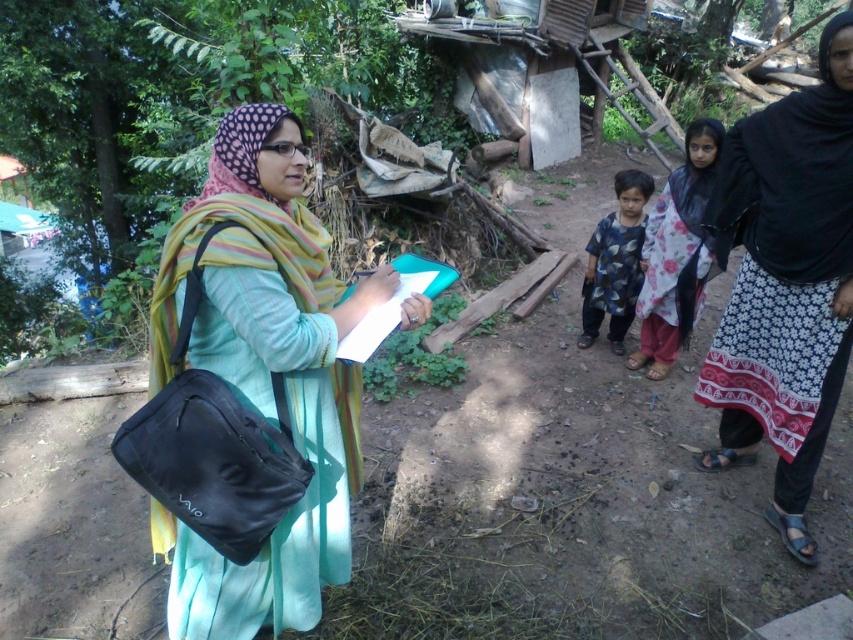
You are a photographer trying to capture the woman in the scene. To ensure both the matte black bag at left and the floral fabric hijab at center are visible in your shot, which object should you focus on first when adjusting your camera angle?

You should focus on the floral fabric hijab at center first because the matte black bag at left is below it, so adjusting the angle to include the higher positioned hijab will naturally include the bag in the frame.

You are a photographer trying to capture the woman in the scene. You want to ensure both the matte black bag at left and the black printed skirt at lower right are visible in the frame. Based on their positions, which object should you focus on first to include both in the shot?

The matte black bag at left is in front of the black printed skirt at lower right, so focusing on the matte black bag at left first would allow both objects to be visible in the frame.